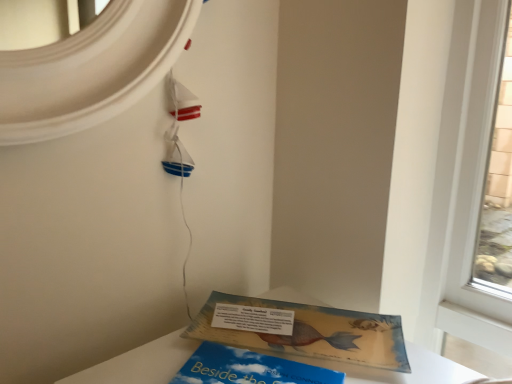
In order to face blue matte book at lower center, marked as the 1th book in a front-to-back arrangement, should I rotate leftwards or rightwards?

You should rotate left by 3.721 degrees.

Where is `white paper at lower center`? This screenshot has height=384, width=512. white paper at lower center is located at coordinates (253, 319).

Considering the relative positions of blue matte book at lower center, marked as the 1th book in a front-to-back arrangement, and matte yellow book at lower center, the second book viewed from the front, in the image provided, is blue matte book at lower center, marked as the 1th book in a front-to-back arrangement, to the right of matte yellow book at lower center, the second book viewed from the front, from the viewer's perspective?

In fact, blue matte book at lower center, marked as the 1th book in a front-to-back arrangement, is to the left of matte yellow book at lower center, the second book viewed from the front.

Looking at this image, is blue matte book at lower center, acting as the 2th book starting from the back, far from matte yellow book at lower center, which appears as the 1th book when viewed from the back?

No.

Considering the relative sizes of blue matte book at lower center, marked as the 1th book in a front-to-back arrangement, and matte yellow book at lower center, the second book viewed from the front, in the image provided, is blue matte book at lower center, marked as the 1th book in a front-to-back arrangement, smaller than matte yellow book at lower center, the second book viewed from the front,?

Correct, blue matte book at lower center, marked as the 1th book in a front-to-back arrangement, occupies less space than matte yellow book at lower center, the second book viewed from the front.

How many degrees apart are the facing directions of blue matte book at lower center, marked as the 1th book in a front-to-back arrangement, and matte yellow book at lower center, the second book viewed from the front?

0.000571 degrees separate the facing orientations of blue matte book at lower center, marked as the 1th book in a front-to-back arrangement, and matte yellow book at lower center, the second book viewed from the front.

Which of these two, matte yellow book at lower center, which appears as the 1th book when viewed from the back, or white paper at lower center, stands shorter?

Standing shorter between the two is matte yellow book at lower center, which appears as the 1th book when viewed from the back.

At what (x,y) coordinates should I click in order to perform the action: click on book on the right of white paper at lower center. Please return your answer as a coordinate pair (x, y). Looking at the image, I should click on (312, 333).

Is the surface of matte yellow book at lower center, the second book viewed from the front, in direct contact with white paper at lower center?

Yes, matte yellow book at lower center, the second book viewed from the front, is beside white paper at lower center.

In the scene shown: Is matte yellow book at lower center, which appears as the 1th book when viewed from the back, inside the boundaries of white paper at lower center, or outside?

matte yellow book at lower center, which appears as the 1th book when viewed from the back, is spatially situated outside white paper at lower center.

Locate an element on the screen. The image size is (512, 384). writing above the blue matte book at lower center, marked as the 1th book in a front-to-back arrangement (from a real-world perspective) is located at coordinates (253, 319).

Considering the sizes of objects white paper at lower center and blue matte book at lower center, marked as the 1th book in a front-to-back arrangement, in the image provided, who is bigger, white paper at lower center or blue matte book at lower center, marked as the 1th book in a front-to-back arrangement,?

With larger size is blue matte book at lower center, marked as the 1th book in a front-to-back arrangement.

Would you say blue matte book at lower center, marked as the 1th book in a front-to-back arrangement, is part of white paper at lower center's contents?

No, blue matte book at lower center, marked as the 1th book in a front-to-back arrangement, is not surrounded by white paper at lower center.

Consider the image. From the image's perspective, between white paper at lower center and blue matte book at lower center, acting as the 2th book starting from the back, which one is located above?

white paper at lower center.

From a real-world perspective, is white paper at lower center under matte yellow book at lower center, the second book viewed from the front?

No, from a real-world perspective, white paper at lower center is not under matte yellow book at lower center, the second book viewed from the front.

You are a GUI agent. You are given a task and a screenshot of the screen. Output one action in this format:
    pyautogui.click(x=<x>, y=<y>)
    Task: Click on the writing that appears above the matte yellow book at lower center, the second book viewed from the front (from the image's perspective)
    The height and width of the screenshot is (384, 512).
    Given the screenshot: What is the action you would take?
    pyautogui.click(x=253, y=319)

From the image's perspective, is white paper at lower center located beneath matte yellow book at lower center, which appears as the 1th book when viewed from the back?

No, from the image's perspective, white paper at lower center is not beneath matte yellow book at lower center, which appears as the 1th book when viewed from the back.

Could you measure the distance between white paper at lower center and matte yellow book at lower center, which appears as the 1th book when viewed from the back?

white paper at lower center is 2.67 inches away from matte yellow book at lower center, which appears as the 1th book when viewed from the back.

From the image's perspective, which one is positioned lower, blue matte book at lower center, marked as the 1th book in a front-to-back arrangement, or white paper at lower center?

blue matte book at lower center, marked as the 1th book in a front-to-back arrangement, from the image's perspective.

Is blue matte book at lower center, acting as the 2th book starting from the back, not inside white paper at lower center?

blue matte book at lower center, acting as the 2th book starting from the back, lies outside white paper at lower center's area.

Consider the image. What's the angular difference between blue matte book at lower center, acting as the 2th book starting from the back, and white paper at lower center's facing directions?

There is a 0.00204-degree angle between the facing directions of blue matte book at lower center, acting as the 2th book starting from the back, and white paper at lower center.

Are blue matte book at lower center, marked as the 1th book in a front-to-back arrangement, and white paper at lower center located far from each other?

No, there isn't a large distance between blue matte book at lower center, marked as the 1th book in a front-to-back arrangement, and white paper at lower center.

Between matte yellow book at lower center, the second book viewed from the front, and blue matte book at lower center, acting as the 2th book starting from the back, which one has larger size?

With larger size is matte yellow book at lower center, the second book viewed from the front.

Are matte yellow book at lower center, the second book viewed from the front, and blue matte book at lower center, marked as the 1th book in a front-to-back arrangement, beside each other?

No.

Is matte yellow book at lower center, which appears as the 1th book when viewed from the back, turned away from blue matte book at lower center, acting as the 2th book starting from the back?

No, matte yellow book at lower center, which appears as the 1th book when viewed from the back, is not facing the opposite direction of blue matte book at lower center, acting as the 2th book starting from the back.

From the image's perspective, does matte yellow book at lower center, the second book viewed from the front, appear lower than blue matte book at lower center, marked as the 1th book in a front-to-back arrangement?

No.

Locate an element on the screen. This screenshot has height=384, width=512. book that is on the right side of blue matte book at lower center, acting as the 2th book starting from the back is located at coordinates (312, 333).

Identify the location of writing lying on the left of matte yellow book at lower center, the second book viewed from the front. The height and width of the screenshot is (384, 512). (253, 319).

Based on their spatial positions, is matte yellow book at lower center, the second book viewed from the front, or white paper at lower center closer to blue matte book at lower center, marked as the 1th book in a front-to-back arrangement?

matte yellow book at lower center, the second book viewed from the front, is positioned closer to the anchor blue matte book at lower center, marked as the 1th book in a front-to-back arrangement.

Estimate the real-world distances between objects in this image. Which object is further from matte yellow book at lower center, which appears as the 1th book when viewed from the back, white paper at lower center or blue matte book at lower center, acting as the 2th book starting from the back?

blue matte book at lower center, acting as the 2th book starting from the back.

Based on their spatial positions, is white paper at lower center or matte yellow book at lower center, the second book viewed from the front, further from blue matte book at lower center, marked as the 1th book in a front-to-back arrangement?

white paper at lower center lies further to blue matte book at lower center, marked as the 1th book in a front-to-back arrangement, than the other object.

From the image, which object appears to be farther from white paper at lower center, blue matte book at lower center, marked as the 1th book in a front-to-back arrangement, or matte yellow book at lower center, which appears as the 1th book when viewed from the back?

blue matte book at lower center, marked as the 1th book in a front-to-back arrangement, lies further to white paper at lower center than the other object.

Which object lies nearer to the anchor point white paper at lower center, matte yellow book at lower center, the second book viewed from the front, or blue matte book at lower center, marked as the 1th book in a front-to-back arrangement?

Among the two, matte yellow book at lower center, the second book viewed from the front, is located nearer to white paper at lower center.

Estimate the real-world distances between objects in this image. Which object is further from matte yellow book at lower center, which appears as the 1th book when viewed from the back, blue matte book at lower center, acting as the 2th book starting from the back, or white paper at lower center?

blue matte book at lower center, acting as the 2th book starting from the back.

This screenshot has height=384, width=512. Identify the location of book located between blue matte book at lower center, acting as the 2th book starting from the back, and white paper at lower center in the depth direction. (312, 333).